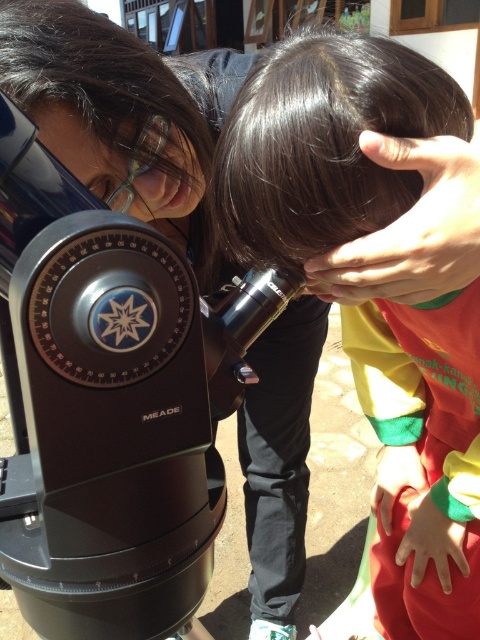
You are a photographer trying to capture a closeup of the dark brown hair at center. The black plastic telescope at left is blocking your view. Can you move the telescope to the side to get a clear shot?

The black plastic telescope at left is shorter than dark brown hair at center, so moving it to the side would allow you to capture the dark brown hair at center without obstruction.

You are a delivery person who needs to place a 12 inch long package between the black plastic telescope at left and the dark brown hair at center. Can you fit the package between them?

The black plastic telescope at left and dark brown hair at center are 10.95 inches apart, which is less than the 12 inch package. The package cannot fit between them.